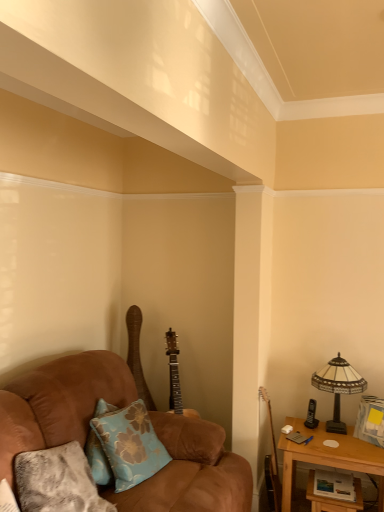
Question: From a real-world perspective, is textured gray pillow at lower left, which appears as the first pillow when viewed from the front, located beneath blue floral fabric pillow at lower left, the 2th pillow when ordered from front to back?

Choices:
 (A) yes
 (B) no

Answer: (A)

Question: Does textured gray pillow at lower left, which appears as the first pillow when viewed from the front, appear on the left side of blue floral fabric pillow at lower left, which is the 1th pillow in back-to-front order?

Choices:
 (A) yes
 (B) no

Answer: (A)

Question: Does textured gray pillow at lower left, which appears as the first pillow when viewed from the front, have a lesser height compared to blue floral fabric pillow at lower left, which is the 1th pillow in back-to-front order?

Choices:
 (A) yes
 (B) no

Answer: (B)

Question: Does textured gray pillow at lower left, which is the second pillow in back-to-front order, appear on the right side of blue floral fabric pillow at lower left, which is the 1th pillow in back-to-front order?

Choices:
 (A) yes
 (B) no

Answer: (B)

Question: Is textured gray pillow at lower left, which appears as the first pillow when viewed from the front, next to blue floral fabric pillow at lower left, which is the 1th pillow in back-to-front order?

Choices:
 (A) no
 (B) yes

Answer: (A)

Question: Considering the relative sizes of textured gray pillow at lower left, which appears as the first pillow when viewed from the front, and blue floral fabric pillow at lower left, which is the 1th pillow in back-to-front order, in the image provided, is textured gray pillow at lower left, which appears as the first pillow when viewed from the front, taller than blue floral fabric pillow at lower left, which is the 1th pillow in back-to-front order,?

Choices:
 (A) yes
 (B) no

Answer: (A)

Question: Can you confirm if wooden acoustic guitar at right, which appears as the 1th guitar when viewed from the front, is shorter than wooden acoustic guitar at center, the 2th guitar when ordered from front to back?

Choices:
 (A) yes
 (B) no

Answer: (A)

Question: From a real-world perspective, is wooden acoustic guitar at right, which ranks as the second guitar in back-to-front order, positioned over wooden acoustic guitar at center, which appears as the first guitar when viewed from the back, based on gravity?

Choices:
 (A) yes
 (B) no

Answer: (B)

Question: Would you say wooden acoustic guitar at right, which ranks as the second guitar in back-to-front order, is a long distance from wooden acoustic guitar at center, which appears as the first guitar when viewed from the back?

Choices:
 (A) no
 (B) yes

Answer: (A)

Question: Considering the relative sizes of wooden acoustic guitar at right, which is the second guitar in left-to-right order, and wooden acoustic guitar at center, which is the 1th guitar in left-to-right order, in the image provided, is wooden acoustic guitar at right, which is the second guitar in left-to-right order, thinner than wooden acoustic guitar at center, which is the 1th guitar in left-to-right order,?

Choices:
 (A) no
 (B) yes

Answer: (B)

Question: Is wooden acoustic guitar at right, which appears as the 1th guitar when viewed from the front, taller than wooden acoustic guitar at center, which is the 1th guitar in left-to-right order?

Choices:
 (A) no
 (B) yes

Answer: (A)

Question: From a real-world perspective, is wooden acoustic guitar at right, which ranks as the second guitar in back-to-front order, positioned under wooden acoustic guitar at center, the 2th guitar when ordered from front to back, based on gravity?

Choices:
 (A) no
 (B) yes

Answer: (B)

Question: From the image's perspective, is blue floral fabric pillow at lower left, the 2th pillow when ordered from front to back, over brown suede couch at left?

Choices:
 (A) no
 (B) yes

Answer: (B)